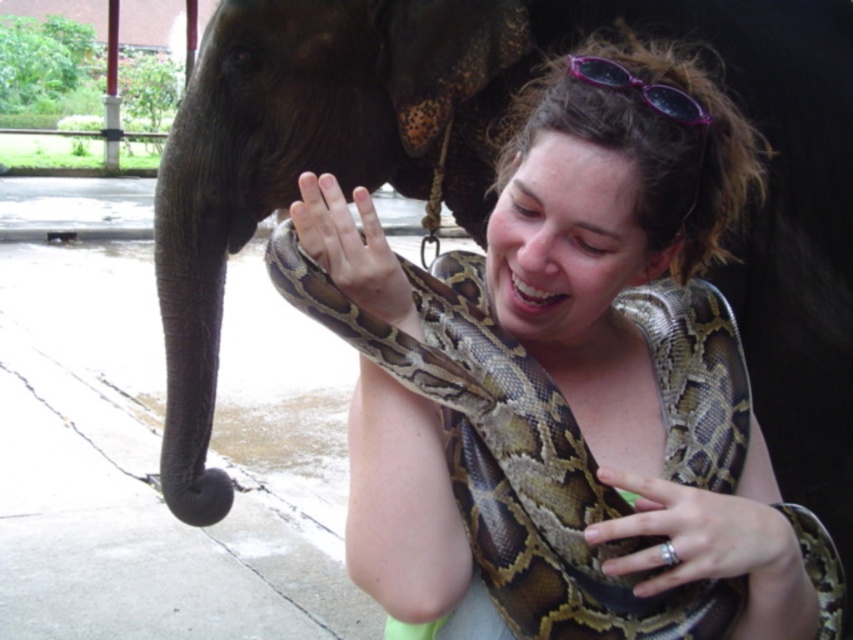
Question: Which of the following is the closest to the observer?

Choices:
 (A) purple plastic goggles at upper center
 (B) brown textured snake at center

Answer: (B)

Question: Which object is the farthest from the purple plastic goggles at upper center?

Choices:
 (A) brown patterned snake at center
 (B) brown textured snake at center

Answer: (A)

Question: Is brown textured snake at center below purple plastic goggles at upper center?

Choices:
 (A) no
 (B) yes

Answer: (B)

Question: Is the position of brown textured snake at center less distant than that of purple plastic goggles at upper center?

Choices:
 (A) yes
 (B) no

Answer: (A)

Question: Which of these objects is positioned closest to the purple plastic goggles at upper center?

Choices:
 (A) brown patterned snake at center
 (B) brown textured snake at center

Answer: (B)

Question: Can you confirm if brown textured snake at center is wider than purple plastic goggles at upper center?

Choices:
 (A) yes
 (B) no

Answer: (A)